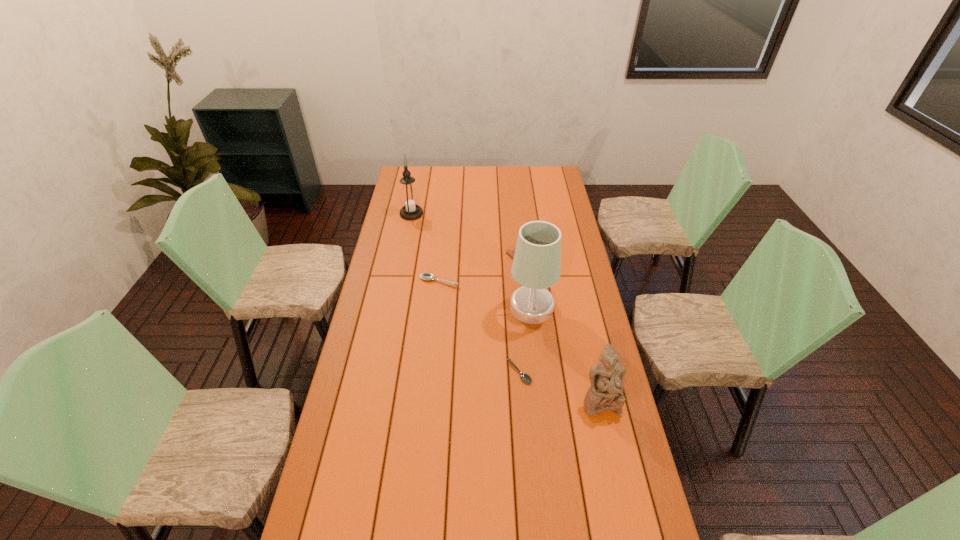
Locate an element on the screen. vacant spot to place a soupspoon on the right is located at coordinates [x=644, y=515].